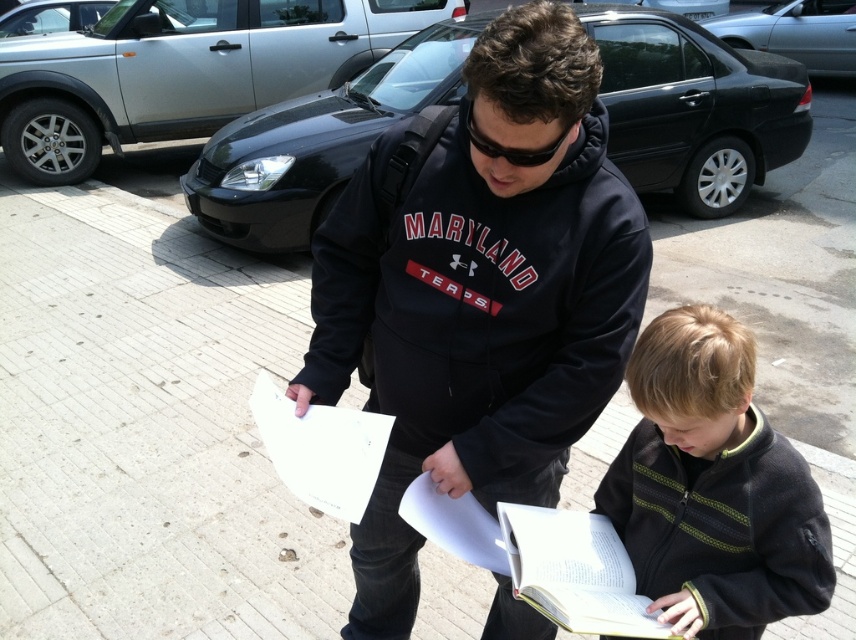
You are a delivery robot that needs to deliver a package to the person wearing the dark gray fleece jacket at lower right. You are currently 1.5 meters away from the jacket. Can you reach them without moving closer than 1 meter?

The dark gray fleece jacket at lower right is 1.09 meters away from the viewer. Since you are currently 1.5 meters away, you can move closer to 1.09 meters to reach them, but this is still within the 1 meter threshold. Therefore, you can deliver the package without moving closer than 1 meter.

You are a delivery person who needs to hand over a package to the recipient. The package is too big to fit in your hands while holding the white paper at center. Can you place the package on the dark gray fleece jacket at lower right?

The dark gray fleece jacket at lower right is positioned under the white paper at center, so placing the package there would be possible as it is a stable surface beneath the paper.